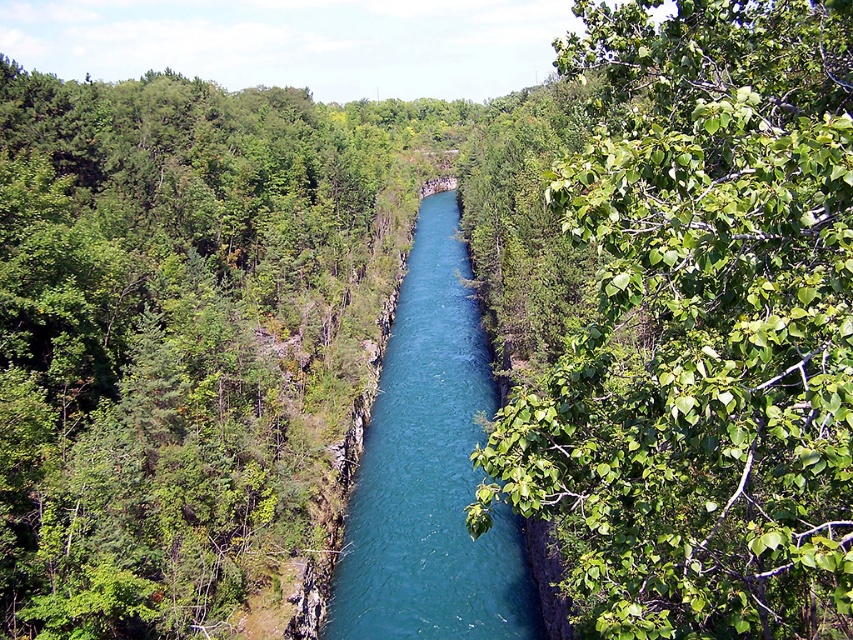
The width and height of the screenshot is (853, 640). What do you see at coordinates (701, 330) in the screenshot?
I see `green leafy tree at center right` at bounding box center [701, 330].

Is point (762, 392) positioned behind point (352, 561)?

No, it is not.

Where is `green leafy tree at center right`? The height and width of the screenshot is (640, 853). green leafy tree at center right is located at coordinates (x=701, y=330).